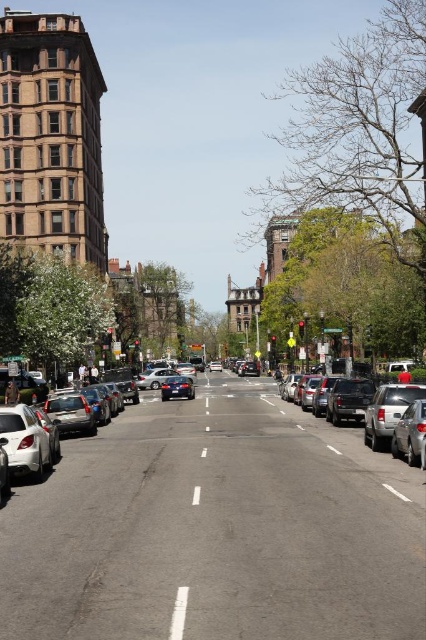
You are a pedestrian standing at the white smooth line at center and want to cross the street to reach the silver metallic sedan at right. The road is 50 feet wide. Is the sedan within the street limits?

The silver metallic sedan at right is 46.81 feet away from the white smooth line at center. Since the road is 50 feet wide, the sedan is within the street limits as it is less than 50 feet away from the line.

You are a delivery driver trying to park your shiny silver sedan at center in a spot that has a white smooth line at center. Can you fit your car into the parking space without overlapping the line?

The white smooth line at center occupies less space than the shiny silver sedan at center, so the car can fit into the parking space without overlapping the line since the line takes up less room.

You are standing at the center of the street and see a point marked at coordinates (373, 408). What object is located at that point?

The point at (373, 408) marks the silver metallic sedan at right.